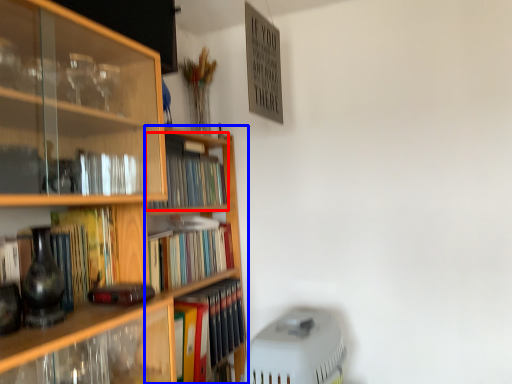
Question: Which object is closer to the camera taking this photo, book (highlighted by a red box) or bookshelf (highlighted by a blue box)?

Choices:
 (A) book
 (B) bookshelf

Answer: (B)